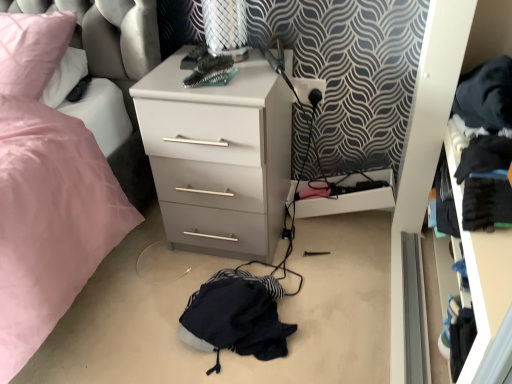
Where is `vacant area to the right of matte gray chest of drawers at center`? The width and height of the screenshot is (512, 384). vacant area to the right of matte gray chest of drawers at center is located at coordinates (326, 254).